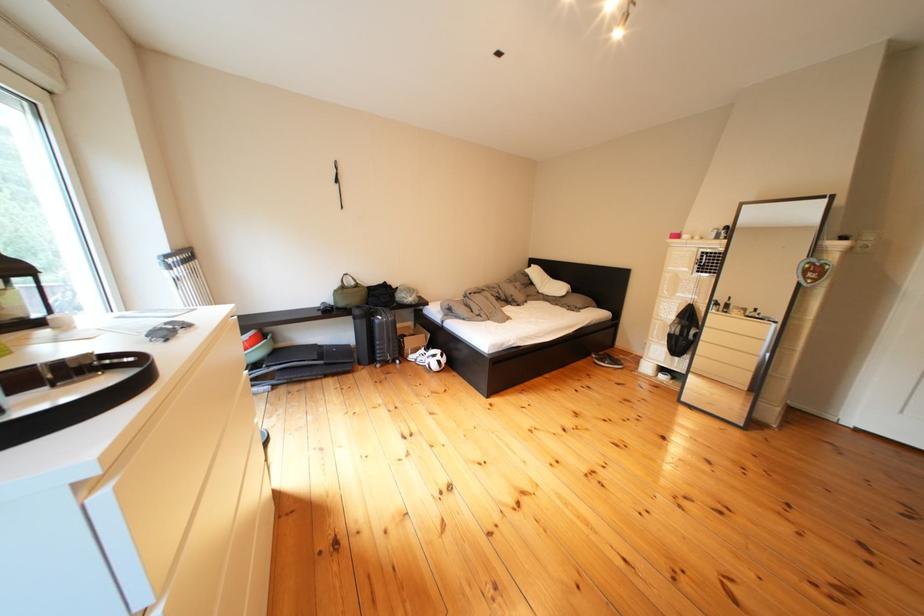
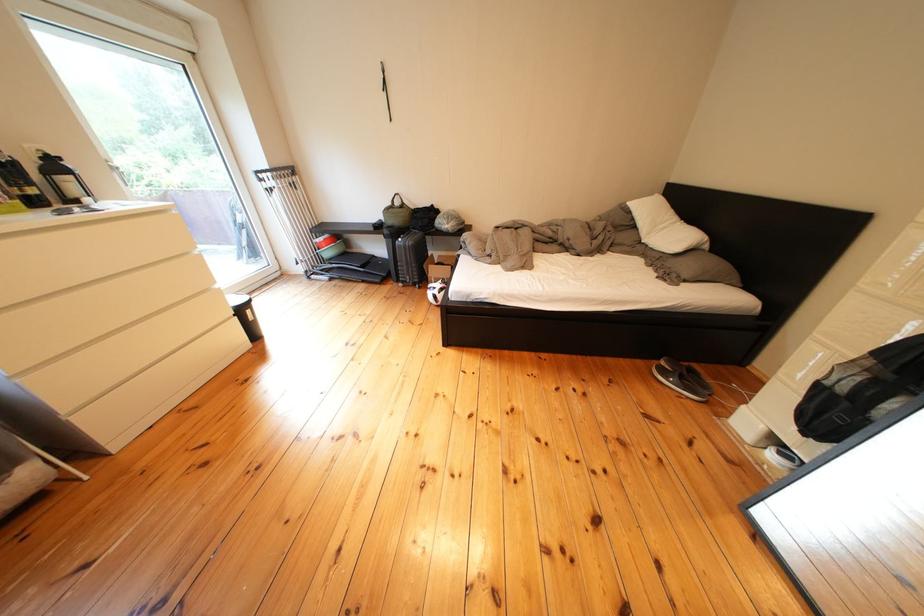
The point at (608,361) is marked in the first image. Where is the corresponding point in the second image?

(676, 368)